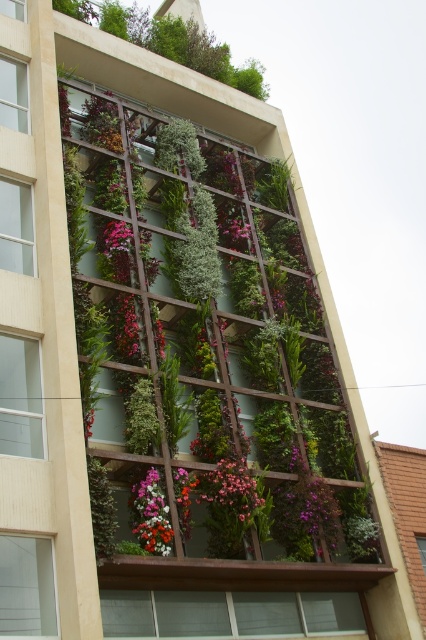
Is point (224, 477) in front of point (157, 509)?

No, (224, 477) is further to viewer.

Identify the location of pink matte flowers at center. [x=232, y=490].